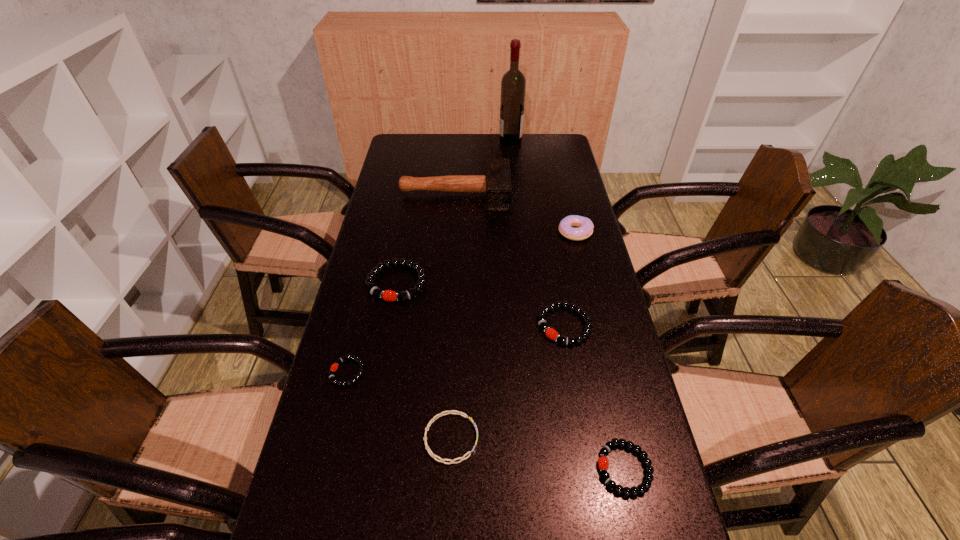
At what (x,y) coordinates should I click in order to perform the action: click on the farthest object. Please return your answer as a coordinate pair (x, y). Looking at the image, I should click on coord(513,84).

Locate an element on the screen. Image resolution: width=960 pixels, height=540 pixels. green alcohol is located at coordinates (513, 84).

This screenshot has width=960, height=540. Find the location of `the second farthest object`. the second farthest object is located at coordinates (496, 182).

Locate an element on the screen. mallet is located at coordinates (496, 182).

Find the location of `the sixth shortest object`. the sixth shortest object is located at coordinates (585, 230).

Where is `the sixth nearest object`? The height and width of the screenshot is (540, 960). the sixth nearest object is located at coordinates (585, 230).

What are the coordinates of `the farthest black bracelet` in the screenshot? It's located at (380, 267).

Locate an element on the screen. Image resolution: width=960 pixels, height=540 pixels. the biggest black bracelet is located at coordinates (380, 267).

In order to click on the third nearest black bracelet in this screenshot , I will do `click(550, 332)`.

This screenshot has height=540, width=960. I want to click on the second tallest bracelet, so click(x=550, y=332).